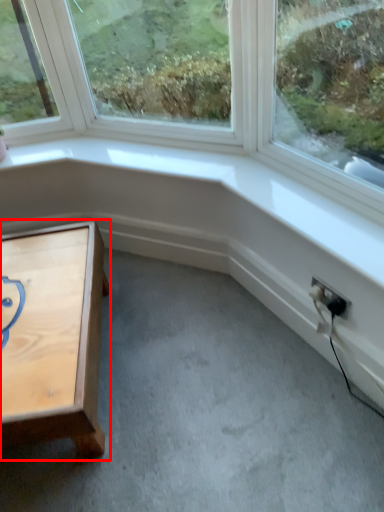
Question: From the image's perspective, what is the correct spatial positioning of table (annotated by the red box) in reference to electric outlet?

Choices:
 (A) below
 (B) above

Answer: (A)